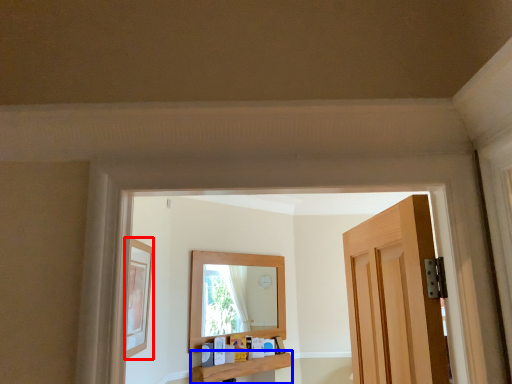
Question: Which of the following is the farthest to the observer, picture frame (highlighted by a red box) or window sill (highlighted by a blue box)?

Choices:
 (A) picture frame
 (B) window sill

Answer: (B)